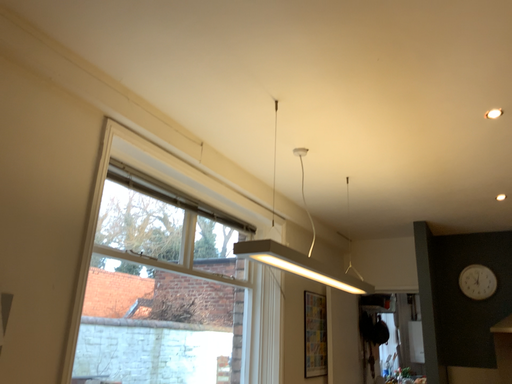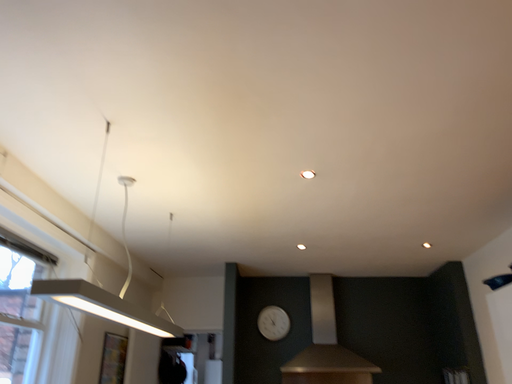
Question: Which way did the camera rotate in the video?

Choices:
 (A) rotated right
 (B) rotated left

Answer: (A)